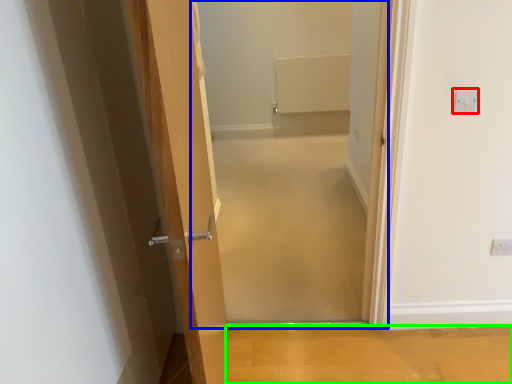
Question: Estimate the real-world distances between objects in this image. Which object is farther from electric outlet (highlighted by a red box), corridor (highlighted by a blue box) or plain (highlighted by a green box)?

Choices:
 (A) corridor
 (B) plain

Answer: (A)